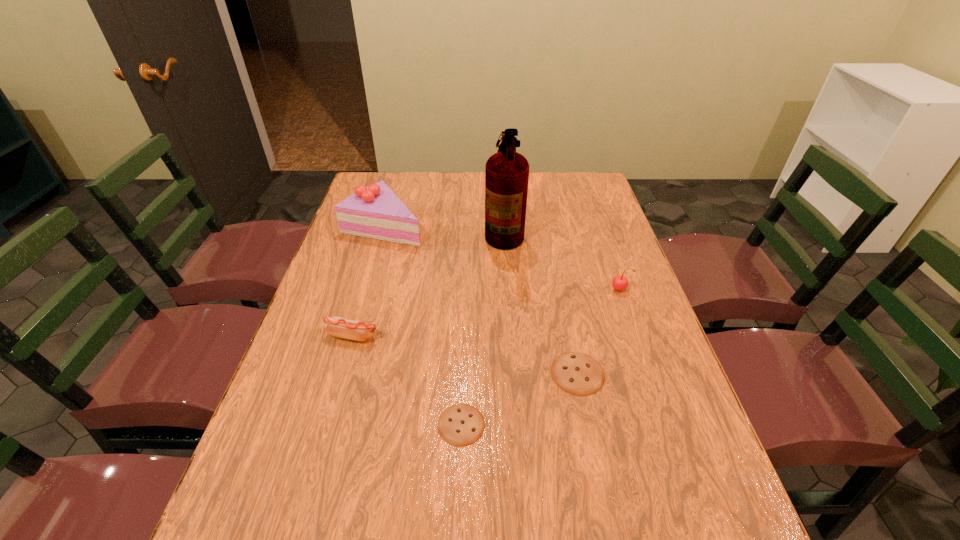
The cookies are evenly distributed in the image. To maintain this, where would you place another cookie on the left? Please point to a free space. Please provide its 2D coordinates. Your answer should be formatted as a tuple, i.e. [(x, y)], where the tuple contains the x and y coordinates of a point satisfying the conditions above.

[(317, 488)]